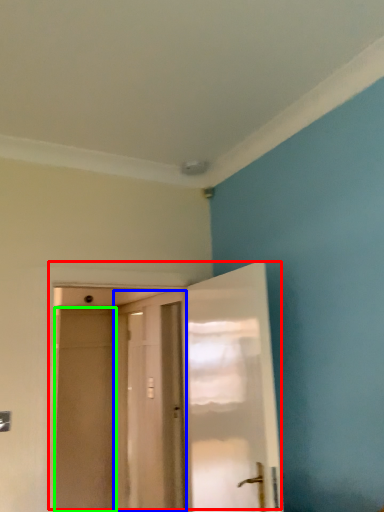
Question: Which is nearer to the door (highlighted by a red box)? door (highlighted by a blue box) or screen door (highlighted by a green box).

Choices:
 (A) door
 (B) screen door

Answer: (B)